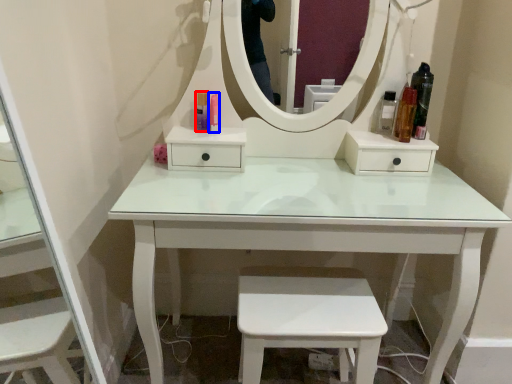
Question: Which object is further to the camera taking this photo, toiletry (highlighted by a red box) or toiletry (highlighted by a blue box)?

Choices:
 (A) toiletry
 (B) toiletry

Answer: (A)